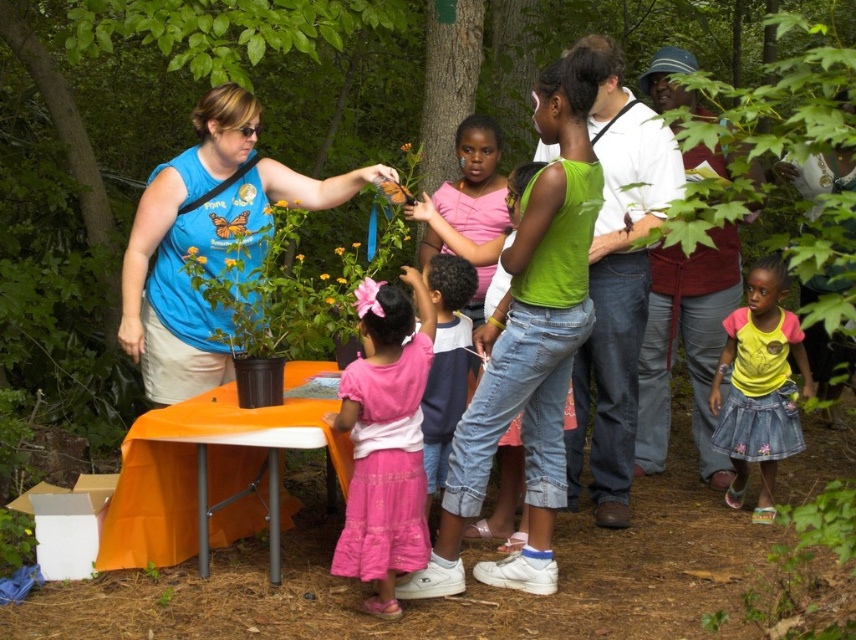
You are standing at point (415, 396) and want to walk to point (229, 141). Is the path directly in front of you or behind you?

The path to point (229, 141) is directly in front of you because point (229, 141) is behind point (415, 396).

You are a photographer trying to capture a photo of the maroon fabric shirt at center and the pink fabric shirt at center. Based on their positions, which one is closer to the camera?

The maroon fabric shirt at center is above the pink fabric shirt at center, so it is closer to the camera.